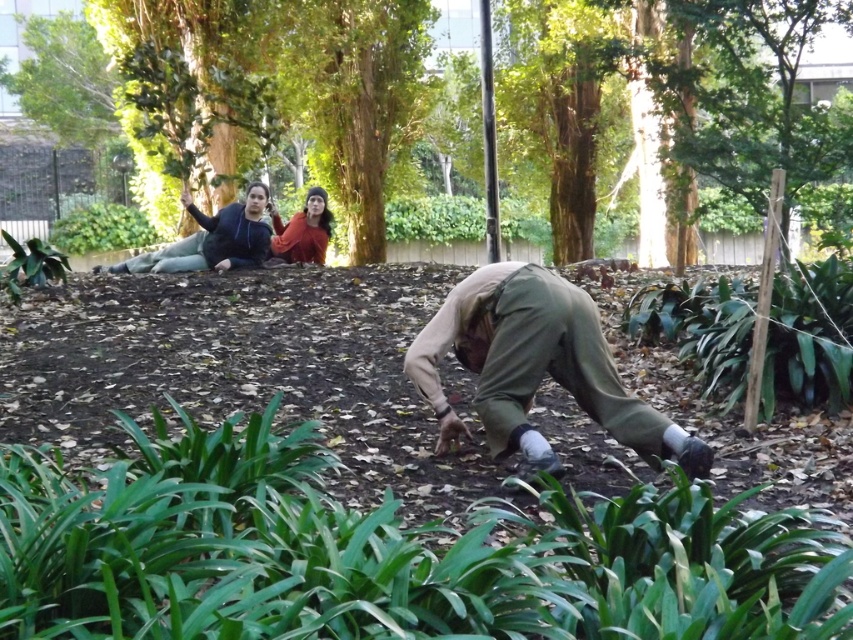
Question: Does brown textured tree at upper center come behind green fabric gardener at upper center?

Choices:
 (A) no
 (B) yes

Answer: (A)

Question: Based on their relative distances, which object is nearer to the matte khaki pants at center?

Choices:
 (A) orange sweater at upper center
 (B) green fabric gardener at upper center

Answer: (B)

Question: Which of the following is the farthest from the observer?

Choices:
 (A) green fabric gardener at upper center
 (B) brown textured tree at upper center

Answer: (A)

Question: Is matte khaki pants at center further to camera compared to green fabric gardener at upper center?

Choices:
 (A) yes
 (B) no

Answer: (B)

Question: Is the position of brown textured tree at upper center more distant than that of orange sweater at upper center?

Choices:
 (A) no
 (B) yes

Answer: (A)

Question: Which of these objects is positioned farthest from the orange sweater at upper center?

Choices:
 (A) brown textured tree at upper center
 (B) matte khaki pants at center

Answer: (B)